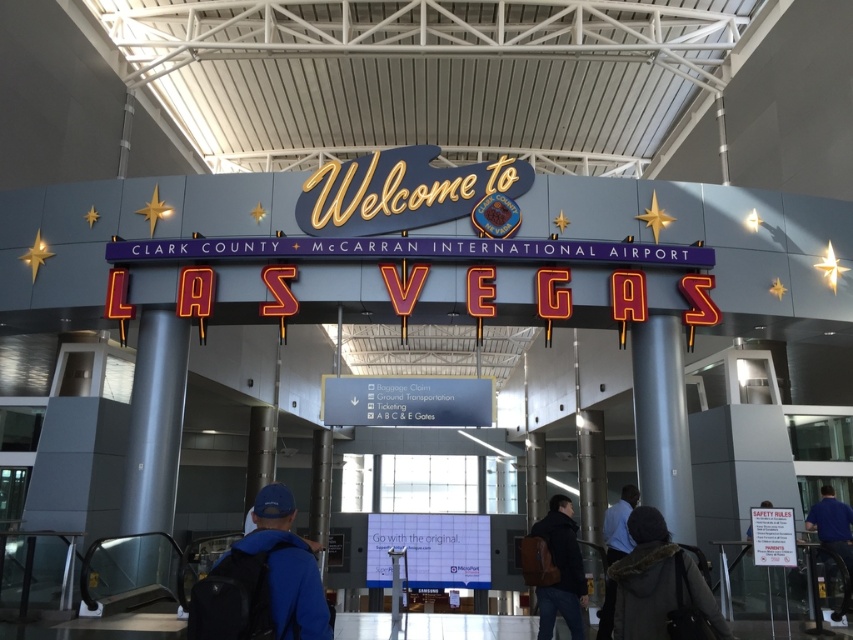
Question: Among these points, which one is farthest from the camera?

Choices:
 (A) (767, 502)
 (B) (614, 506)
 (C) (277, 572)

Answer: (A)

Question: Which object appears closest to the camera in this image?

Choices:
 (A) dark brown fur coat at lower right
 (B) blue fabric shirt at right
 (C) blue fabric backpack at lower left
 (D) leather backpack at lower right

Answer: (C)

Question: From the image, what is the correct spatial relationship of blue fabric backpack at lower left in relation to leather backpack at lower right?

Choices:
 (A) left
 (B) right

Answer: (A)

Question: Which point is farther to the camera?

Choices:
 (A) (577, 609)
 (B) (817, 504)
 (C) (613, 557)

Answer: (B)

Question: From the image, what is the correct spatial relationship of metallic gray pillar at center in relation to leather backpack at lower right?

Choices:
 (A) right
 (B) left

Answer: (A)

Question: Is the position of gray metallic pillar at left less distant than that of metallic gray pillar at center?

Choices:
 (A) no
 (B) yes

Answer: (A)